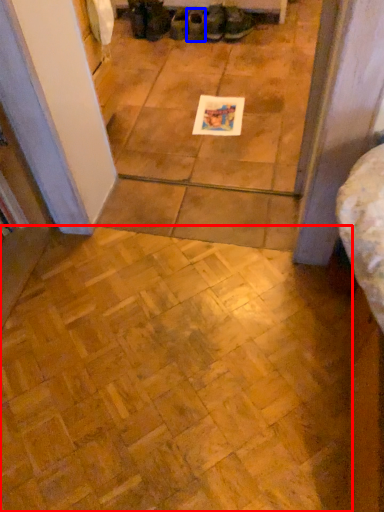
Question: Which point is closer to the camera, ceramic tile (highlighted by a red box) or footwear (highlighted by a blue box)?

Choices:
 (A) ceramic tile
 (B) footwear

Answer: (A)